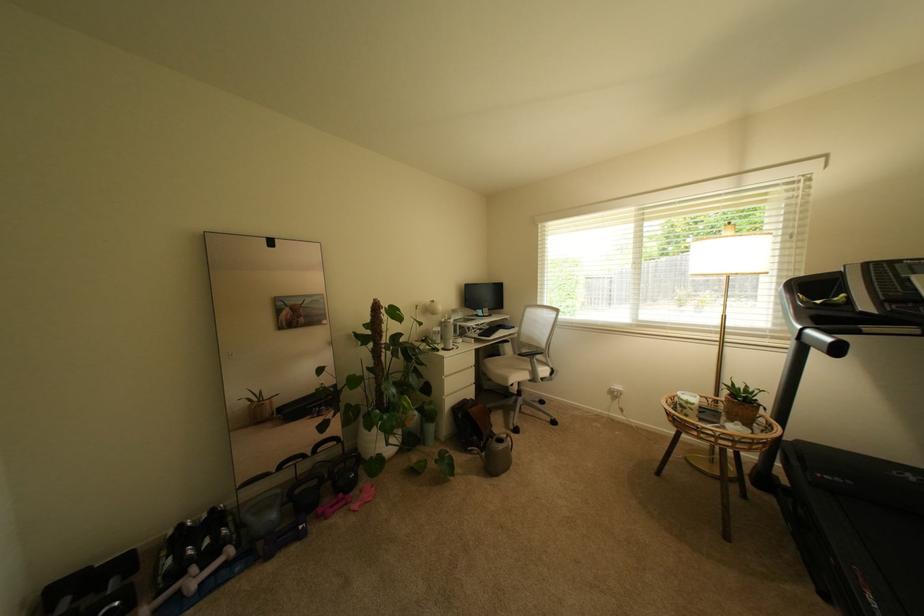
What do you see at coordinates (834, 368) in the screenshot?
I see `a treadmill handle` at bounding box center [834, 368].